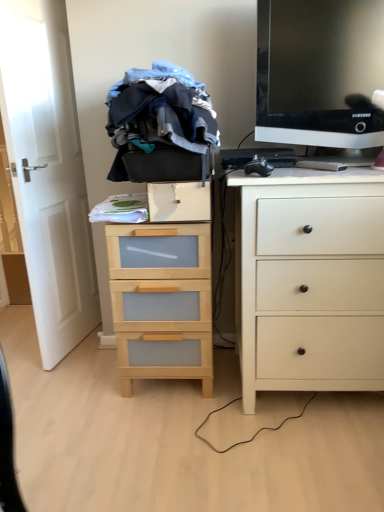
Where is `empty space that is to the right of black plastic computer mouse at upper right`? The width and height of the screenshot is (384, 512). empty space that is to the right of black plastic computer mouse at upper right is located at coordinates (312, 172).